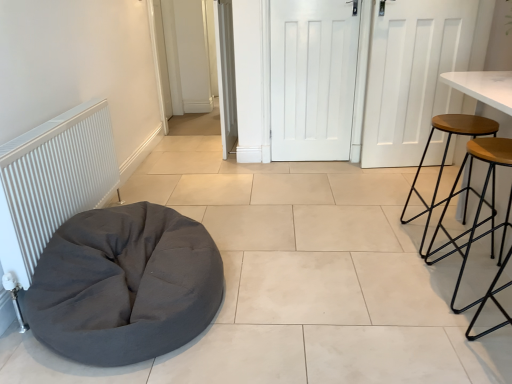
This screenshot has height=384, width=512. Identify the location of vacant space situated on the left part of white matte door at center, which is the 1th door from left to right. (195, 146).